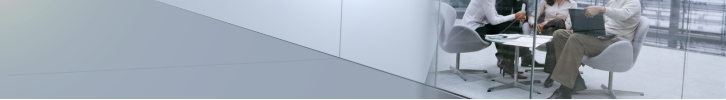
The height and width of the screenshot is (100, 726). I want to click on office floor, so click(x=653, y=63).